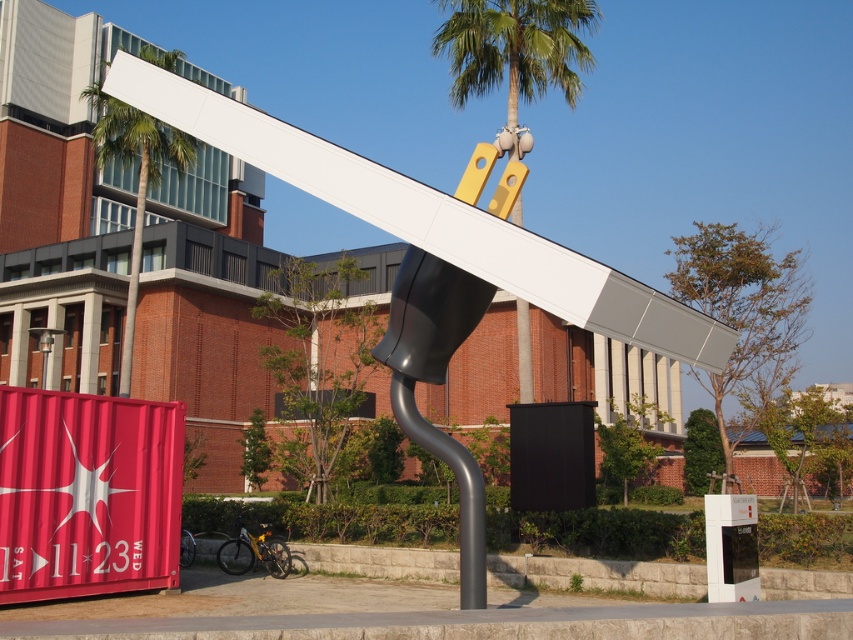
Question: Which object appears closest to the camera in this image?

Choices:
 (A) green leafy palm tree at upper left
 (B) green leafy palm tree at upper center

Answer: (A)

Question: Is green leafy palm tree at upper center above green leafy palm tree at upper left?

Choices:
 (A) yes
 (B) no

Answer: (A)

Question: Can you confirm if green leafy palm tree at upper center is thinner than green leafy palm tree at upper left?

Choices:
 (A) yes
 (B) no

Answer: (A)

Question: Which point is farther from the camera taking this photo?

Choices:
 (A) (143, 182)
 (B) (514, 54)

Answer: (A)

Question: Is green leafy palm tree at upper center above green leafy palm tree at upper left?

Choices:
 (A) no
 (B) yes

Answer: (B)